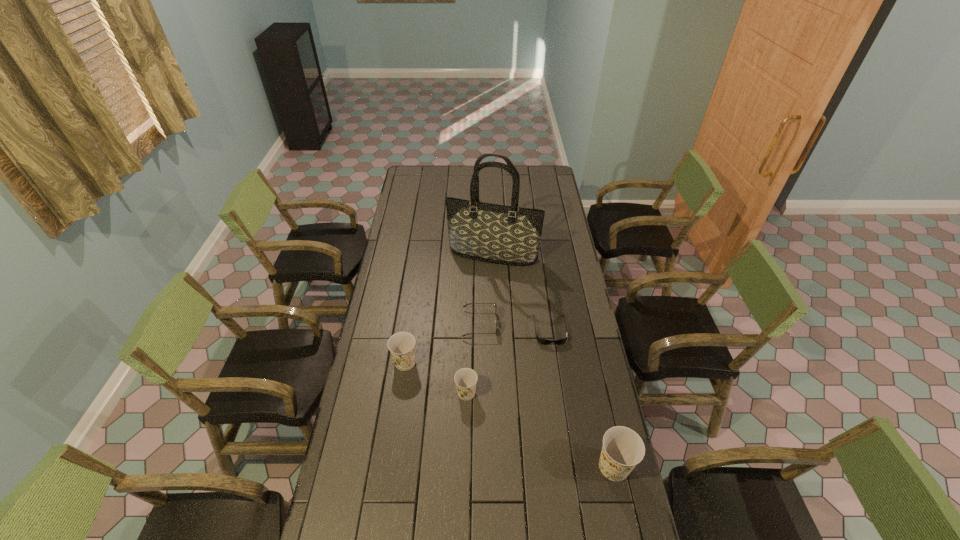
Identify the location of the tallest object. (510, 235).

Find the location of a particular element. The image size is (960, 540). the farthest object is located at coordinates (510, 235).

The width and height of the screenshot is (960, 540). In order to click on free space located on the back of the fourth farthest object in this screenshot , I will do `click(415, 295)`.

Identify the location of free region located on the front of the second nearest object. (466, 443).

I want to click on free space located 0.290m on the left of the nearest Dixie cup, so click(505, 467).

Identify the location of vacant area situated on the front-facing side of the shortest object. (562, 409).

This screenshot has width=960, height=540. Find the location of `free space located 0.090m on the lenses of the fifth tallest object`. free space located 0.090m on the lenses of the fifth tallest object is located at coordinates (518, 323).

This screenshot has height=540, width=960. I want to click on free space located 0.250m on the back of the tote bag, so click(492, 214).

Find the location of a particular element. object present at the left edge is located at coordinates (402, 344).

The image size is (960, 540). Find the location of `Dixie cup located at the right edge`. Dixie cup located at the right edge is located at coordinates (623, 448).